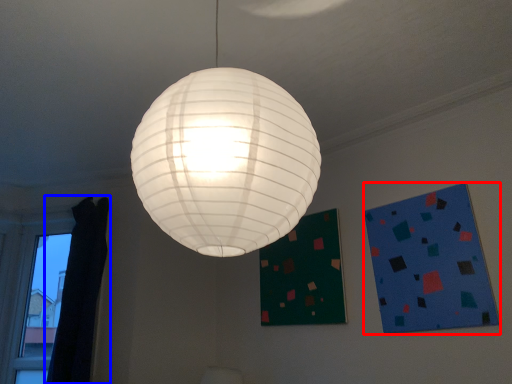
Question: Which object appears farthest to the camera in this image, design (highlighted by a red box) or curtain (highlighted by a blue box)?

Choices:
 (A) design
 (B) curtain

Answer: (B)